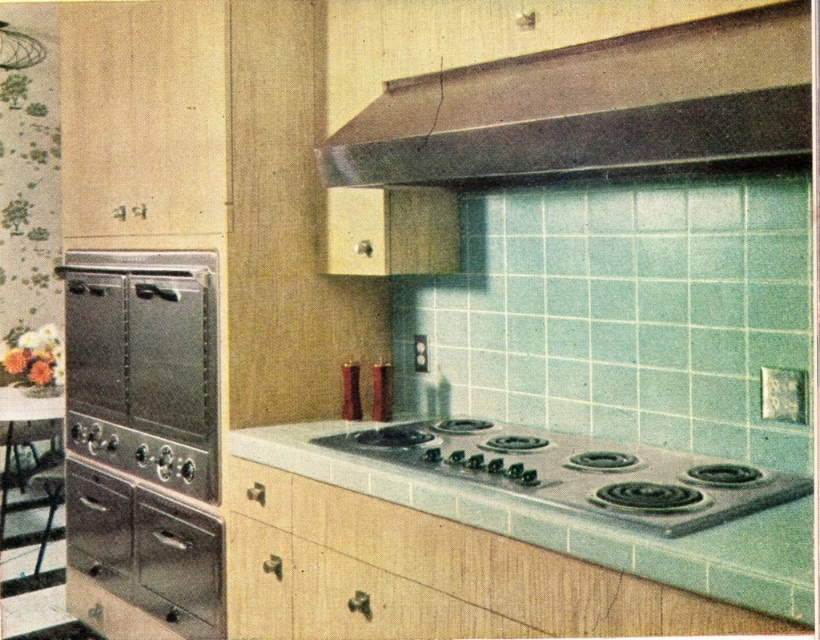
Question: Which object is closer to the camera taking this photo?

Choices:
 (A) metallic brown exhaust hood at upper center
 (B) white laminate countertop at center
 (C) stainless steel oven at left
 (D) wooden drawer at lower center

Answer: (B)

Question: Is white laminate countertop at center smaller than wooden drawer at lower center?

Choices:
 (A) no
 (B) yes

Answer: (A)

Question: Can you confirm if white laminate countertop at center is positioned below brushed metal drawer at lower left?

Choices:
 (A) yes
 (B) no

Answer: (B)

Question: Can you confirm if brushed metal drawer at lower left is positioned below wooden drawer at lower center?

Choices:
 (A) no
 (B) yes

Answer: (B)

Question: Which point is closer to the camera taking this photo?

Choices:
 (A) (499, 484)
 (B) (531, 134)
 (C) (270, 481)
 (D) (312, 436)

Answer: (A)

Question: Which object is closer to the camera taking this photo?

Choices:
 (A) white laminate countertop at center
 (B) brushed metal drawer at lower left

Answer: (A)